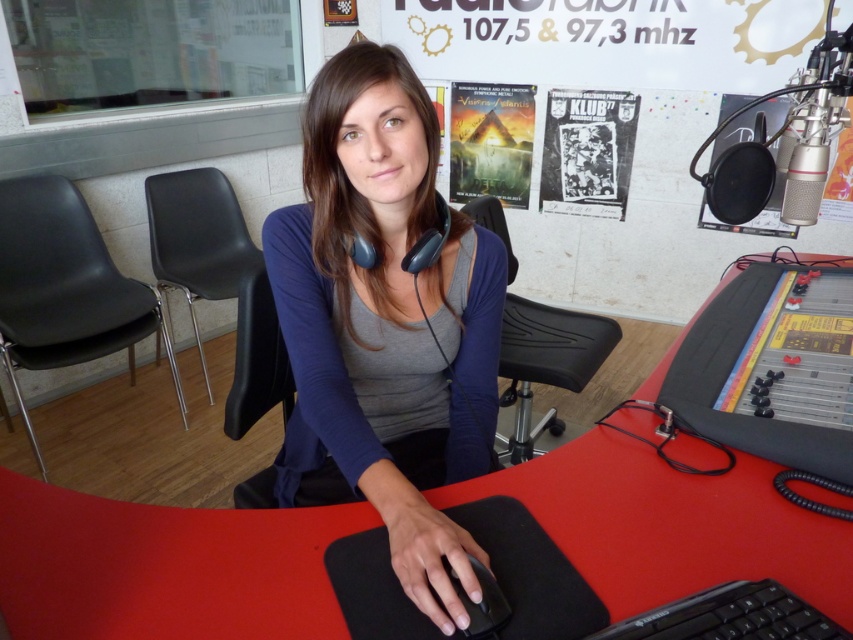
Question: Which object is farther from the camera taking this photo?

Choices:
 (A) black paper poster at upper center
 (B) black matte mouse at center

Answer: (A)

Question: Which of the following is the farthest from the observer?

Choices:
 (A) black leather chair at center
 (B) matte paper poster at upper center
 (C) black paper poster at upper center
 (D) matte black mouse at center

Answer: (B)

Question: Considering the relative positions of black leather chair at center and black paper poster at upper center in the image provided, where is black leather chair at center located with respect to black paper poster at upper center?

Choices:
 (A) above
 (B) below

Answer: (B)

Question: Where is matte black mouse at center located in relation to black plastic keyboard at lower right in the image?

Choices:
 (A) above
 (B) below

Answer: (A)

Question: Is black plastic chair at left positioned in front of black plastic keyboard at lower right?

Choices:
 (A) yes
 (B) no

Answer: (B)

Question: Which of the following is the farthest from the observer?

Choices:
 (A) (21, 196)
 (B) (392, 451)
 (C) (514, 168)

Answer: (C)